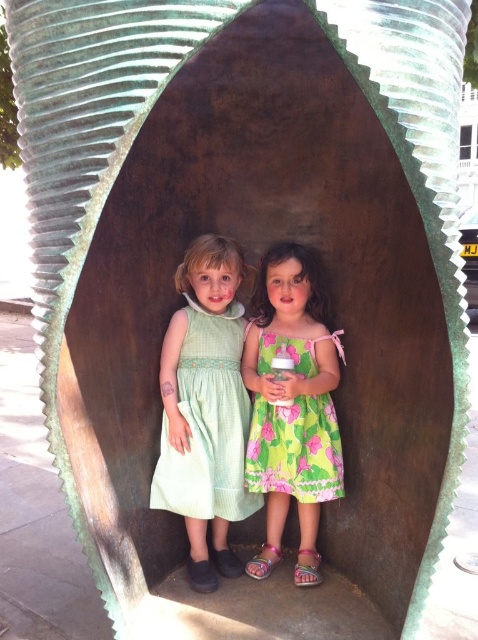
Question: Which of the following is the farthest from the observer?

Choices:
 (A) green textured dress at center
 (B) green floral dress at center

Answer: (A)

Question: Does green textured dress at center have a greater width compared to green floral dress at center?

Choices:
 (A) no
 (B) yes

Answer: (B)

Question: Is green textured dress at center positioned in front of green floral dress at center?

Choices:
 (A) no
 (B) yes

Answer: (A)

Question: Which of the following is the farthest from the observer?

Choices:
 (A) green textured dress at center
 (B) green floral dress at center

Answer: (A)

Question: Does green textured dress at center come in front of green floral dress at center?

Choices:
 (A) yes
 (B) no

Answer: (B)